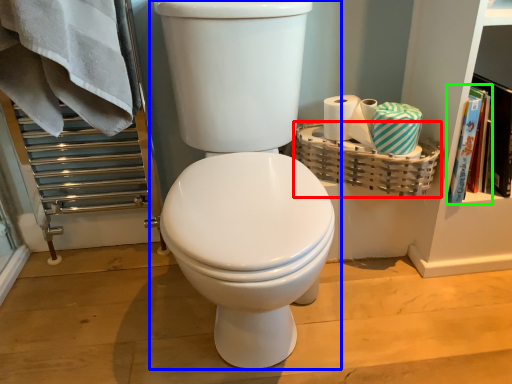
Question: Which object is the farthest from basket (highlighted by a red box)? Choose among these: toilet (highlighted by a blue box) or book (highlighted by a green box).

Choices:
 (A) toilet
 (B) book

Answer: (A)